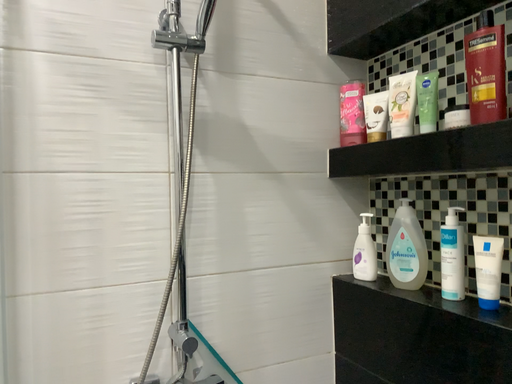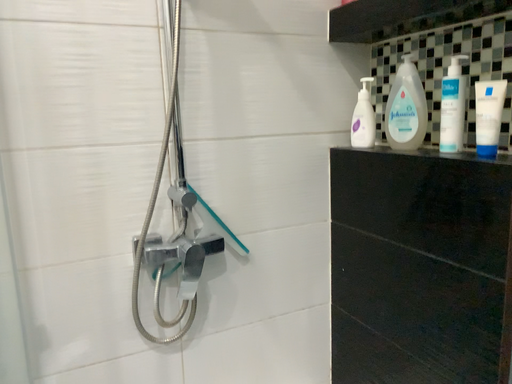
Question: How did the camera likely rotate when shooting the video?

Choices:
 (A) rotated downward
 (B) rotated upward

Answer: (A)